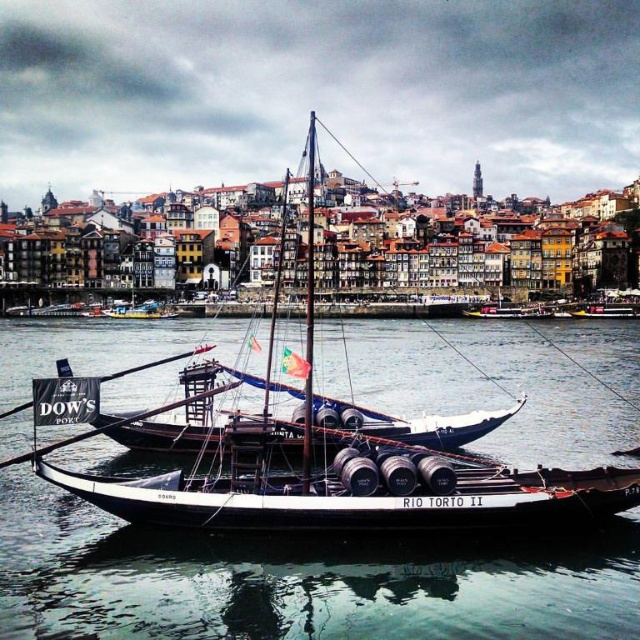
Which is more to the left, clear water at center or wooden barrel boat at center?

clear water at center is more to the left.

Who is positioned more to the right, clear water at center or wooden barrel boat at center?

From the viewer's perspective, wooden barrel boat at center appears more on the right side.

Describe the element at coordinates (300, 580) in the screenshot. I see `clear water at center` at that location.

Identify the location of clear water at center. This screenshot has width=640, height=640. pos(300,580).